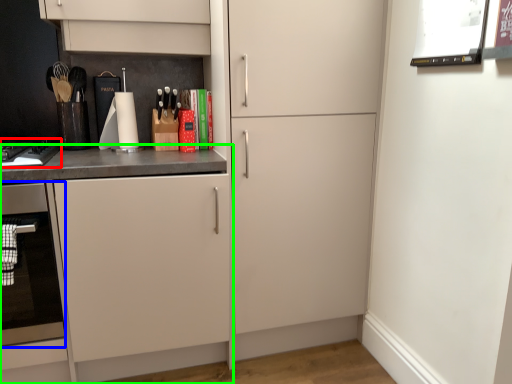
Question: Which is nearer to the home appliance (highlighted by a red box)? oven (highlighted by a blue box) or cabinetry (highlighted by a green box).

Choices:
 (A) oven
 (B) cabinetry

Answer: (B)